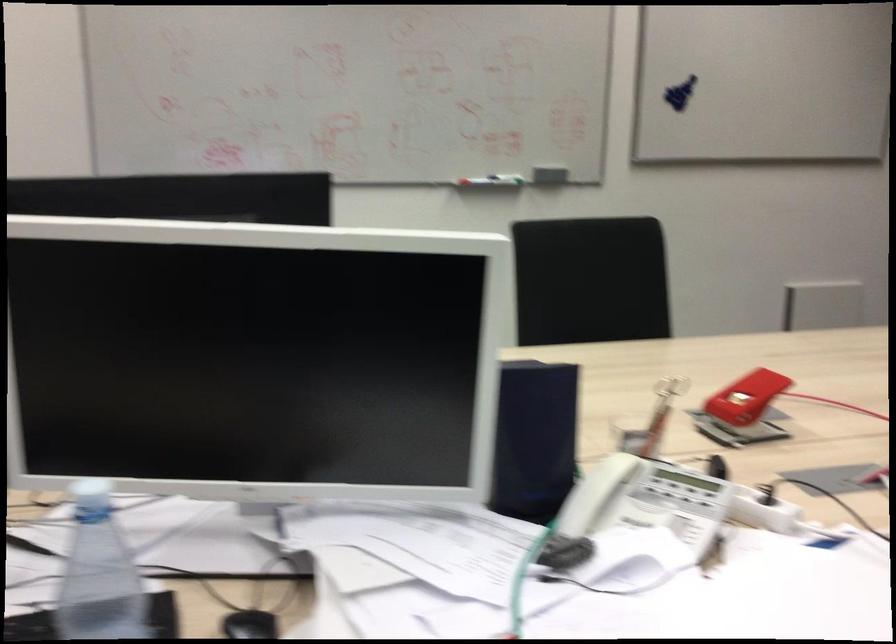
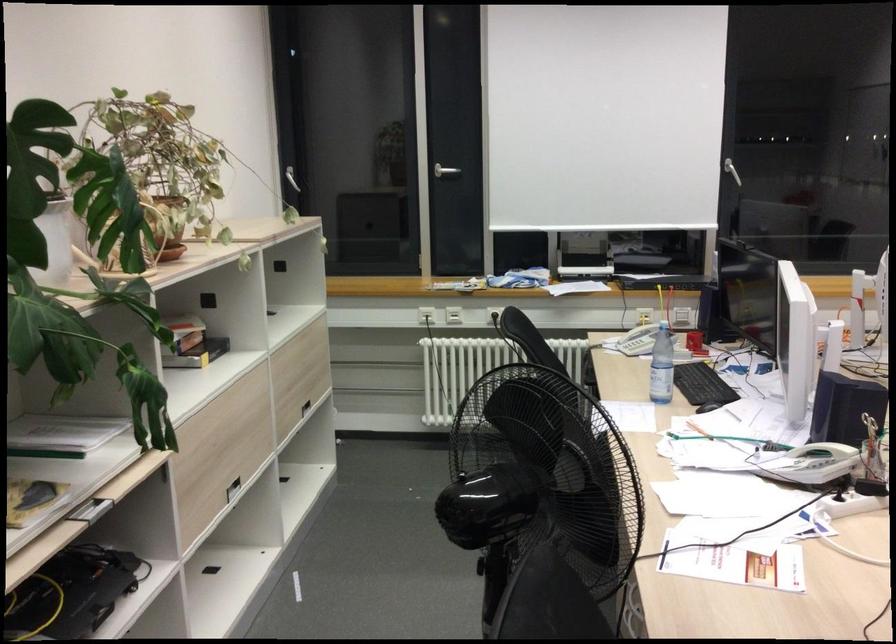
In the second image, find the point that corresponds to (627,518) in the first image.

(814, 464)